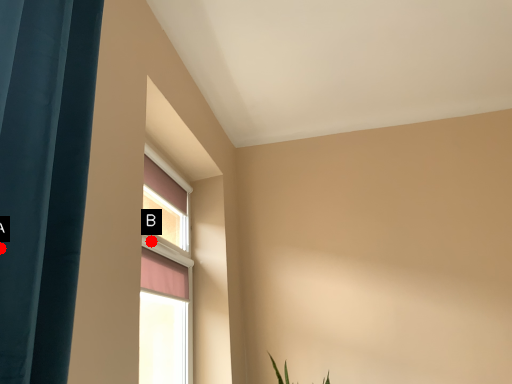
Question: Two points are circled on the image, labeled by A and B beside each circle. Which point appears farthest from the camera in this image?

Choices:
 (A) A is further
 (B) B is further

Answer: (B)